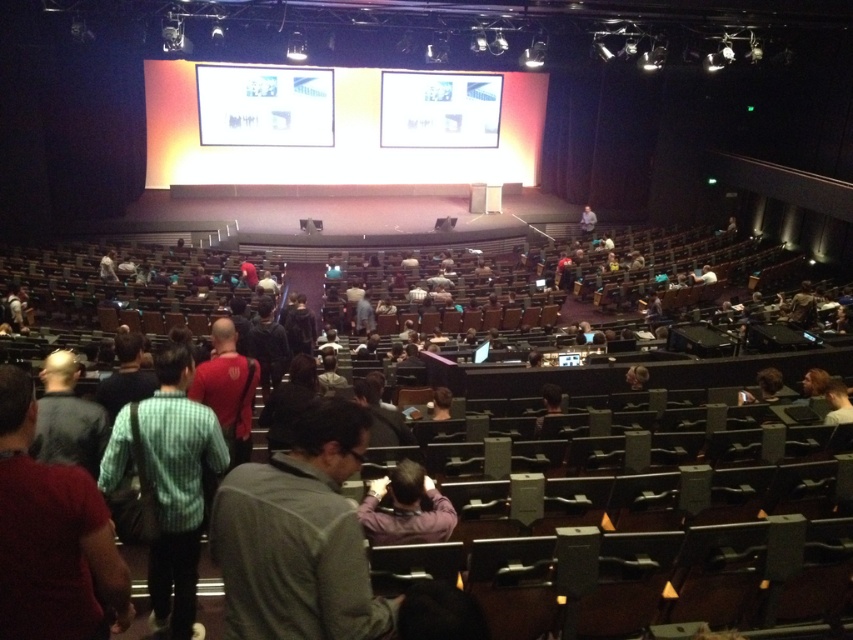
Which is below, green checkered shirt at left or white glossy screen at upper center?

Positioned lower is green checkered shirt at left.

How far apart are green checkered shirt at left and white glossy screen at upper center?

A distance of 72.39 feet exists between green checkered shirt at left and white glossy screen at upper center.

Between point (155, 557) and point (334, 125), which one is positioned behind?

The point (334, 125) is more distant.

Where is `green checkered shirt at left`? The height and width of the screenshot is (640, 853). green checkered shirt at left is located at coordinates (177, 488).

Can you confirm if green checkered shirt at left is wider than purple matte shirt at center?

Indeed, green checkered shirt at left has a greater width compared to purple matte shirt at center.

Is the position of green checkered shirt at left more distant than that of purple matte shirt at center?

That is False.

The width and height of the screenshot is (853, 640). What do you see at coordinates (177, 488) in the screenshot?
I see `green checkered shirt at left` at bounding box center [177, 488].

Locate an element on the screen. Image resolution: width=853 pixels, height=640 pixels. green checkered shirt at left is located at coordinates (177, 488).

Which is in front, point (39, 547) or point (589, 228)?

Point (39, 547) is more forward.

Is point (6, 497) more distant than point (590, 227)?

No, it is not.

Locate an element on the screen. Image resolution: width=853 pixels, height=640 pixels. green checkered shirt at center is located at coordinates (51, 536).